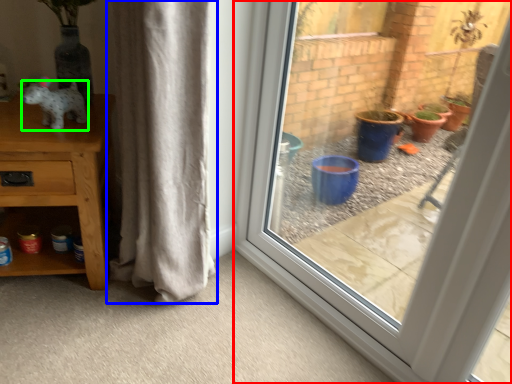
Question: Which is nearer to the window (highlighted by a red box)? curtain (highlighted by a blue box) or animal (highlighted by a green box).

Choices:
 (A) curtain
 (B) animal

Answer: (A)